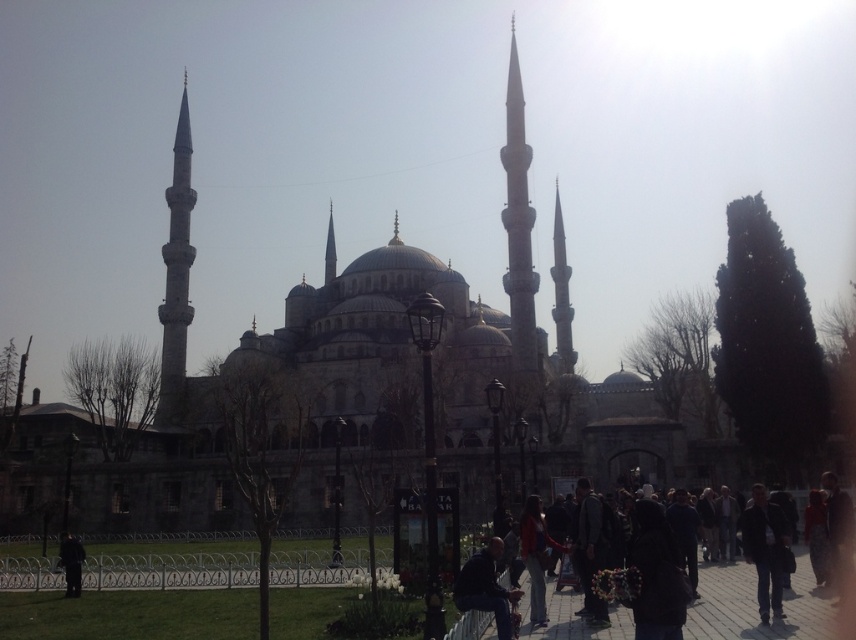
You are standing at the center of the paved area in front of the mosque. You want to take a photo of the smooth stone minaret at left from the best angle. According to the coordinates provided, where should you position yourself relative to the minaret to capture it fully in the frame?

The smooth stone minaret at left is located at coordinates [176,273]. To capture it fully in the frame, you should position yourself to the right of the minaret so that it fits within the camera view.

Looking at this image, you are standing at the entrance of the mosque and see the dark red jacket at lower center and the smooth stone minaret at left. Which object is closer to the entrance?

The dark red jacket at lower center is closer to the entrance because it is positioned to the right of the smooth stone minaret at left, which is further away from the entrance.

You are a tourist standing at the entrance of the mosque. You see the smooth stone minaret at left and the dark blue jeans at lower center. Which object is closer to you?

The dark blue jeans at lower center are closer to you because the smooth stone minaret at left is positioned over it, indicating it is further away.